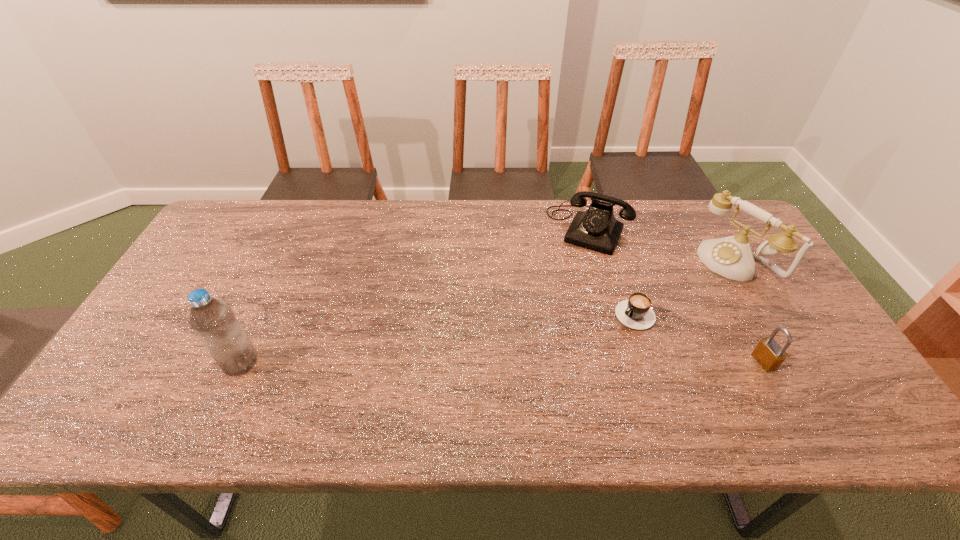
Locate an element on the screen. This screenshot has width=960, height=540. padlock situated at the near edge is located at coordinates (768, 352).

At what (x,y) coordinates should I click in order to perform the action: click on padlock at the right edge. Please return your answer as a coordinate pair (x, y). This screenshot has height=540, width=960. Looking at the image, I should click on (768, 352).

This screenshot has height=540, width=960. What are the coordinates of `telephone that is at the right edge` in the screenshot? It's located at (731, 257).

The height and width of the screenshot is (540, 960). Identify the location of object that is at the far right corner. (731, 257).

The width and height of the screenshot is (960, 540). In order to click on object that is positioned at the near right corner in this screenshot , I will do `click(768, 352)`.

In the image, there is a desktop. Identify the location of free space at the far edge. (481, 238).

Locate an element on the screen. The height and width of the screenshot is (540, 960). vacant space at the near edge of the desktop is located at coordinates (255, 384).

The image size is (960, 540). Identify the location of free space at the left edge of the desktop. (153, 362).

Find the location of a particular element. Image resolution: width=960 pixels, height=540 pixels. vacant region at the right edge of the desktop is located at coordinates (727, 279).

In the image, there is a desktop. Identify the location of vacant space at the far left corner. The image size is (960, 540). (213, 240).